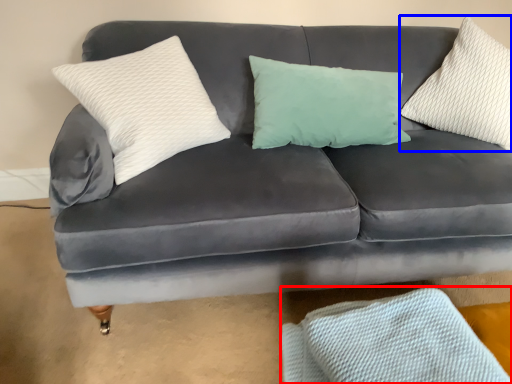
Question: Which object appears farthest to the camera in this image, material (highlighted by a red box) or pillow (highlighted by a blue box)?

Choices:
 (A) material
 (B) pillow

Answer: (B)